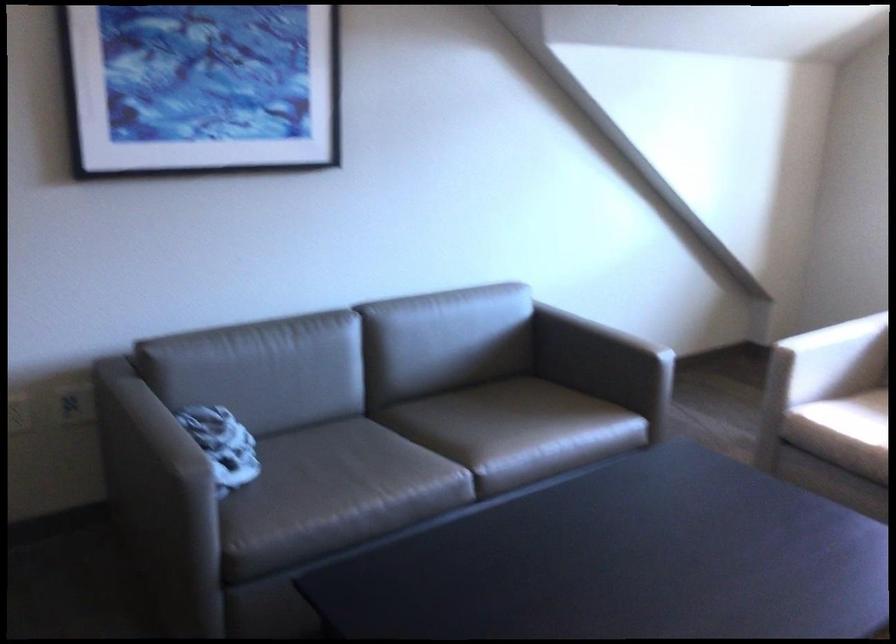
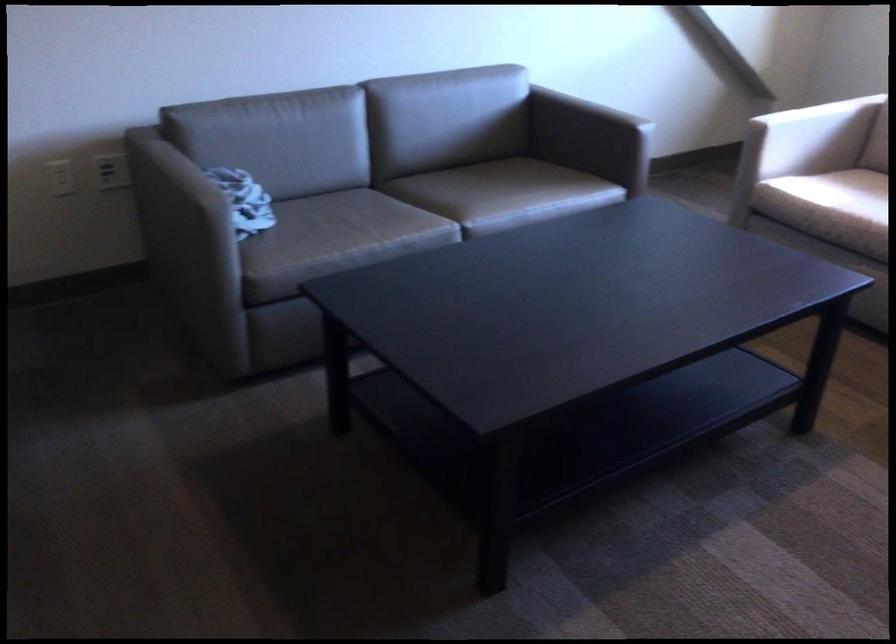
The point at (x=504, y=433) is marked in the first image. Where is the corresponding point in the second image?

(489, 194)